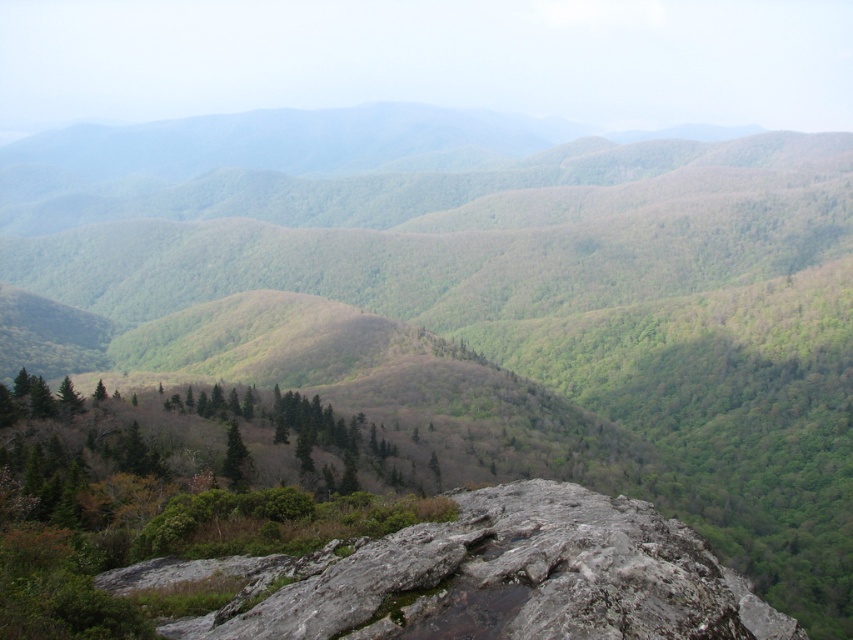
You are a hiker trying to navigate through the mountainous landscape. You see a gray rough rock at center and a green matte tree at center. Which one has a greater width?

The gray rough rock at center has a greater width than the green matte tree at center.

Looking at this image, you are a hiker standing at the edge of the rocky outcrop. You see the gray rough rock at center and the green matte tree at center. Which object is closer to you?

The gray rough rock at center is positioned over the green matte tree at center, so the gray rough rock at center is closer to you.

You are a photographer standing at the edge of a cliff, and you want to capture a closeup shot of the gray rough rock at center. Your camera has a minimum focusing distance of 10 feet. Can you take the photo without moving closer to the rock?

The gray rough rock at center is 58.89 feet away from the camera. Since the minimum focusing distance is 10 feet, the photographer can take the photo without moving closer because the rock is farther than the minimum distance required.